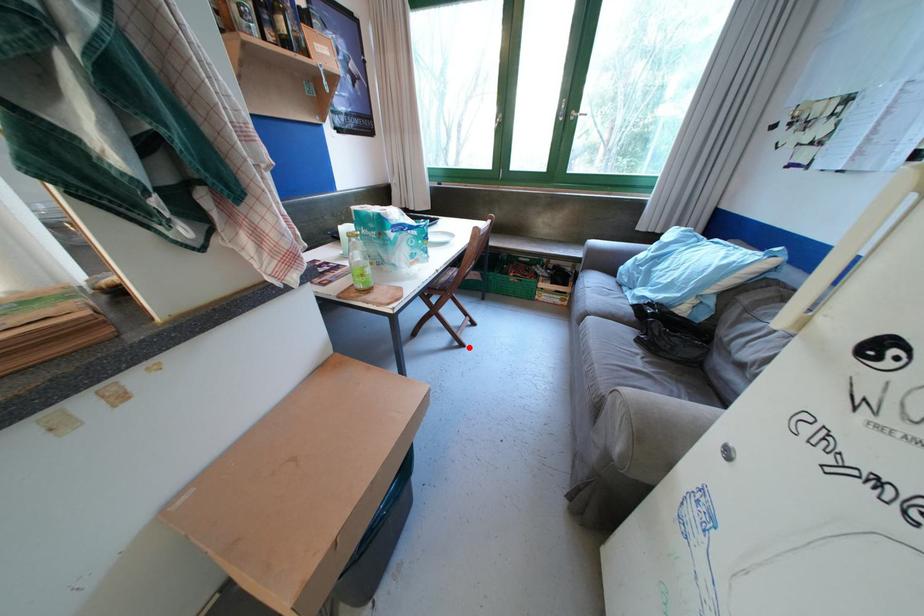
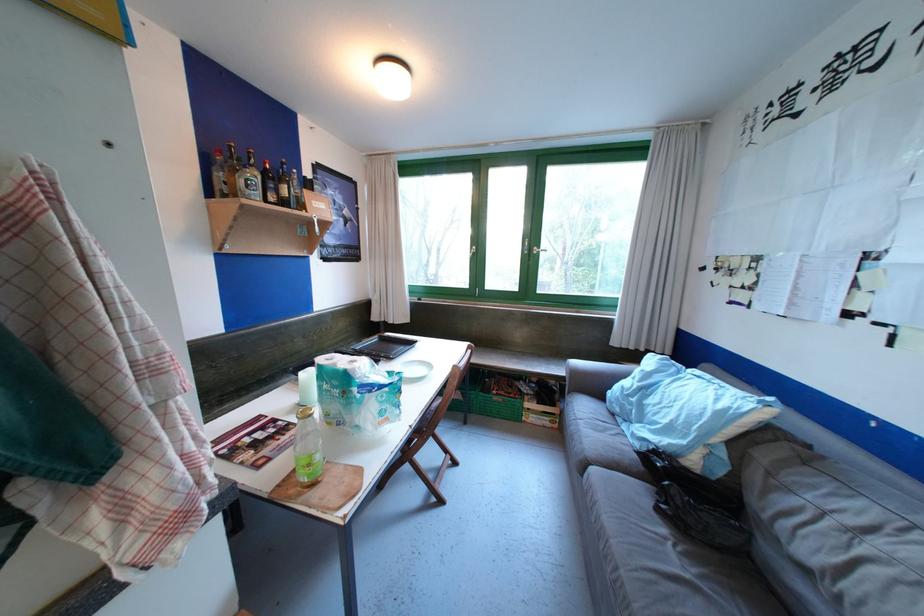
Question: I am providing you with two images of the same scene from different viewpoints. Given a red point in image1, look at the same physical point in image2. Is it:

Choices:
 (A) Closer to the viewpoint
 (B) Farther from the viewpoint

Answer: (B)